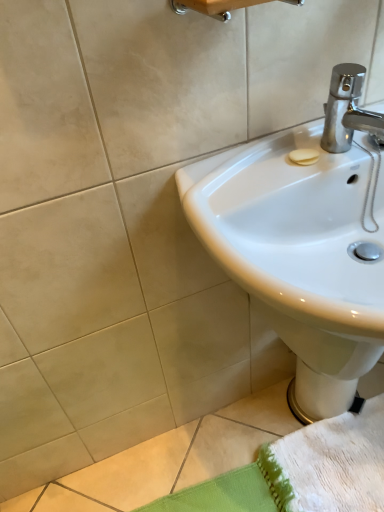
What are the coordinates of `blank area beneath white glossy sink at upper right (from a real-world perspective)` in the screenshot? It's located at (326, 462).